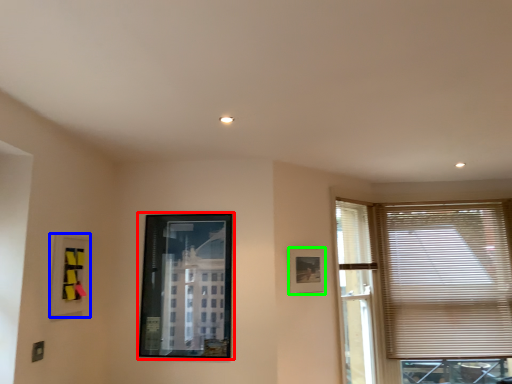
Question: Which object is the closest to the picture frame (highlighted by a red box)? Choose among these: picture frame (highlighted by a blue box) or picture frame (highlighted by a green box).

Choices:
 (A) picture frame
 (B) picture frame

Answer: (A)